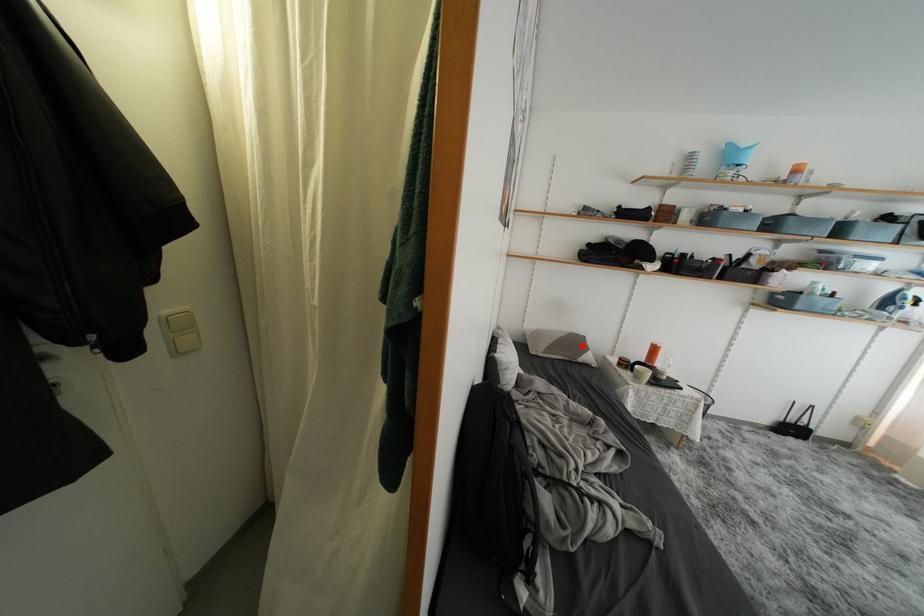
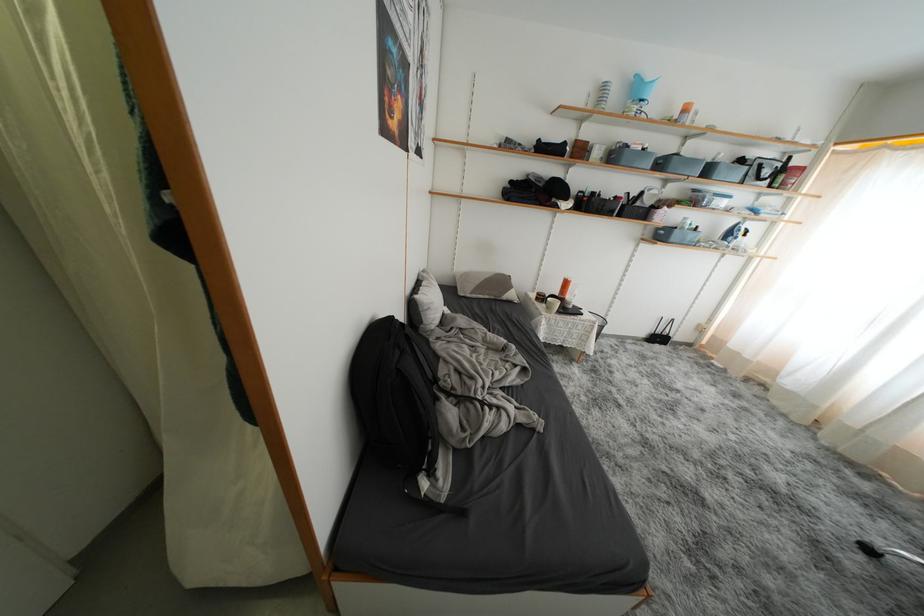
Question: A red point is marked in image1. In image2, is the corresponding 3D point closer to the camera or farther? Reply with the corresponding letter.

Choices:
 (A) The corresponding 3D point is closer.
 (B) The corresponding 3D point is farther.

Answer: (A)